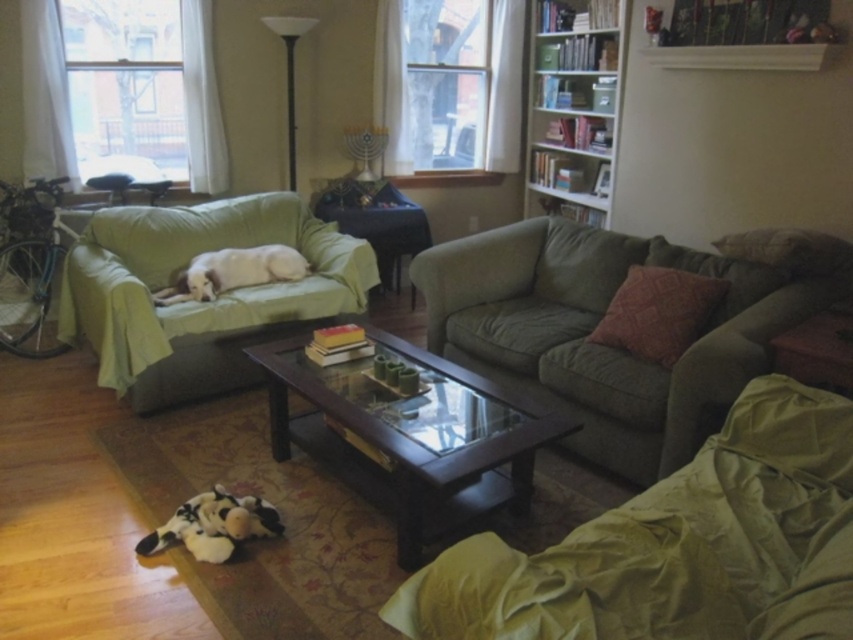
You are planning to place a large potted plant in the living room. The plant requires a space that can accommodate its size. Based on the scene, which object between the green fabric couch at left and the transparent glass coffee table at center would you consider for placing the plant, and why?

The green fabric couch at left has a larger size compared to the transparent glass coffee table at center, so the plant should be placed near the green fabric couch at left as it offers more space.

You are trying to decide whether to place a large rectangular plant stand between the transparent glass coffee table at center and the transparent glass window at upper left. The plant stand is 1.2 meters wide. Can it fit between them?

The transparent glass coffee table at center is wider than the transparent glass window at upper left. However, the question is about fitting a plant stand between them, but the provided description only compares their widths, not the distance between them. Therefore, insufficient information is available to determine if the plant stand can fit.